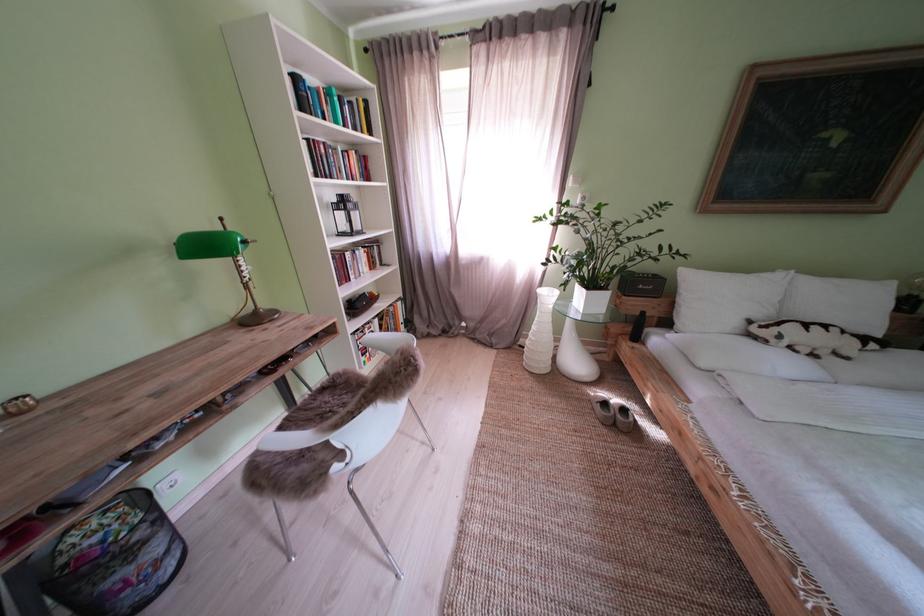
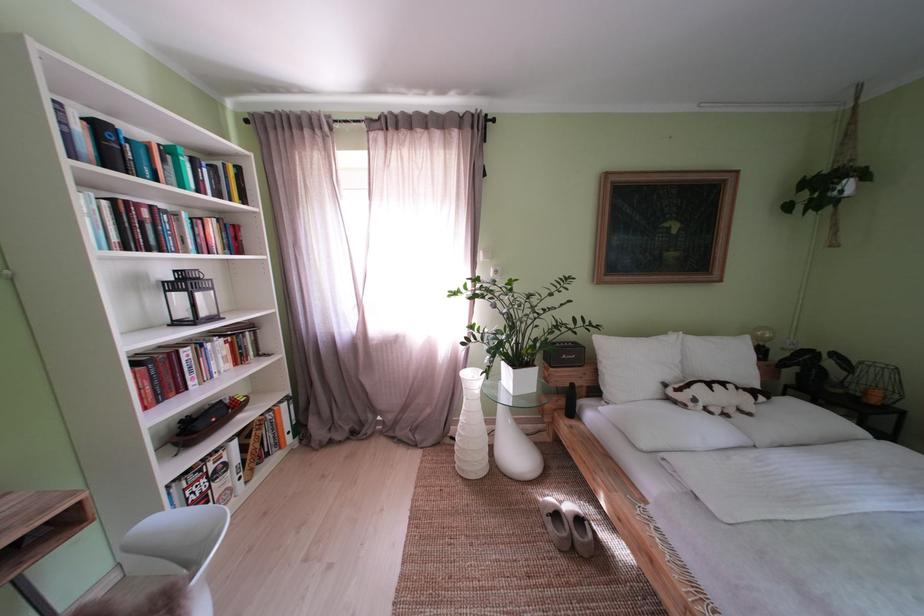
Locate, in the second image, the point that corresponds to (544,331) in the first image.

(472, 424)